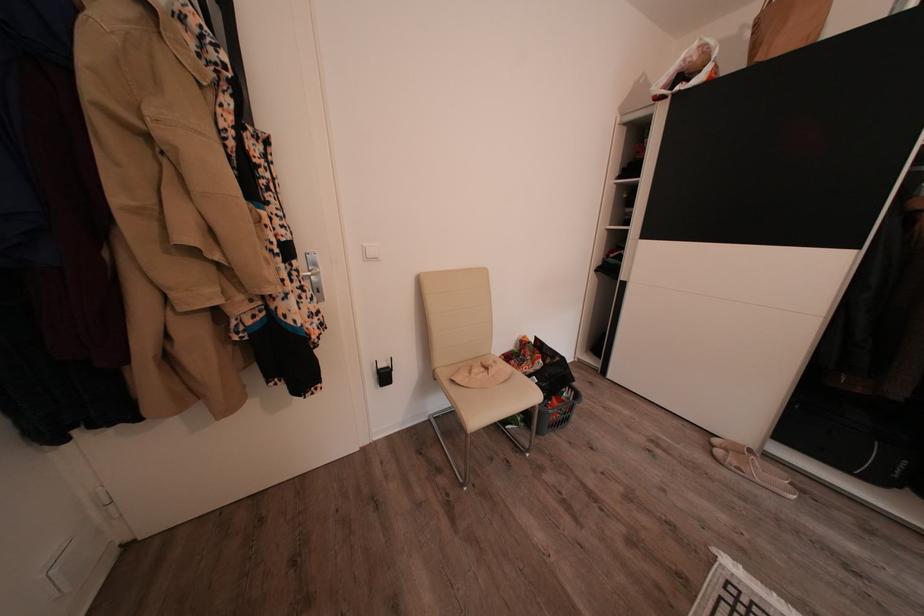
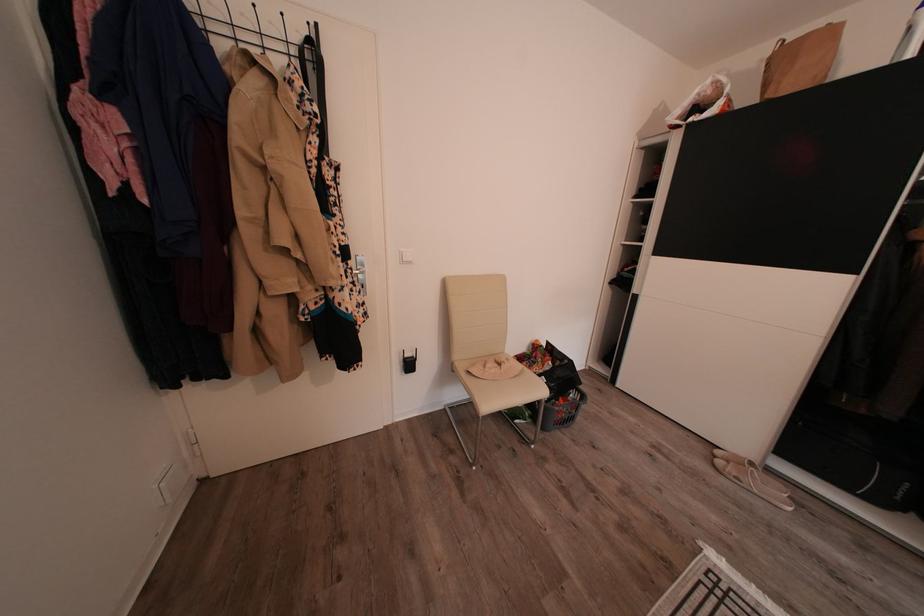
Locate, in the second image, the point that corresponds to point (504, 368) in the first image.

(516, 365)